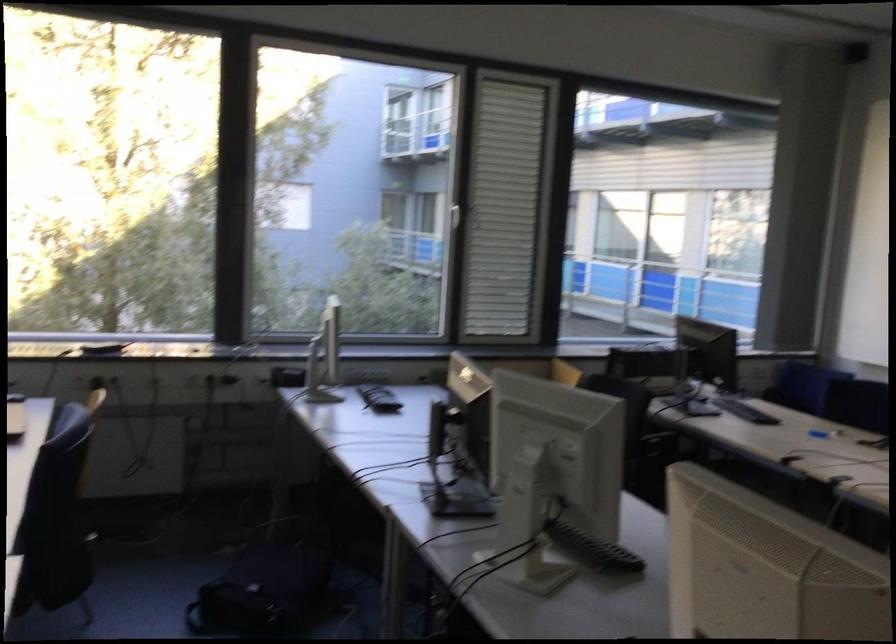
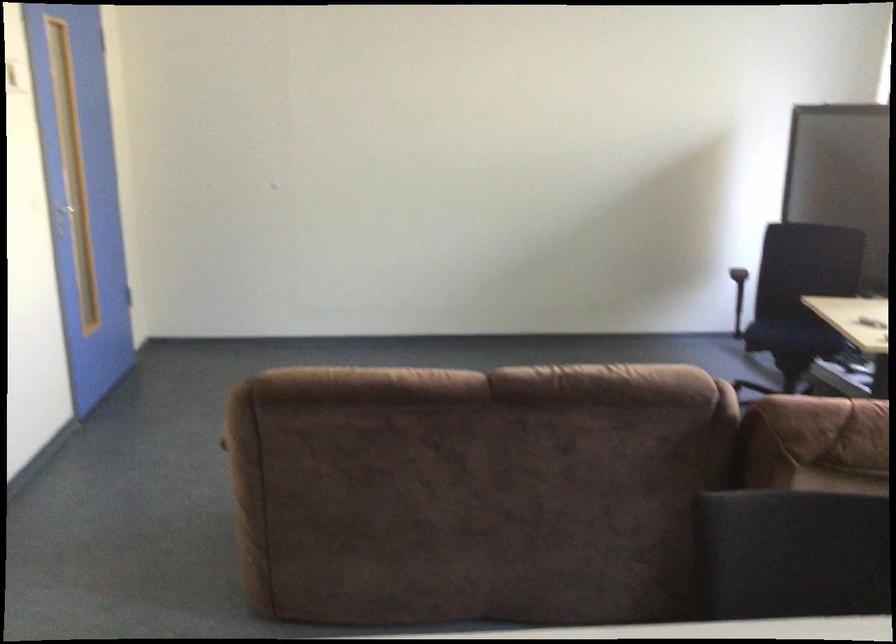
Based on the continuous images, in which direction is the camera rotating?

The camera rotated toward left-down.